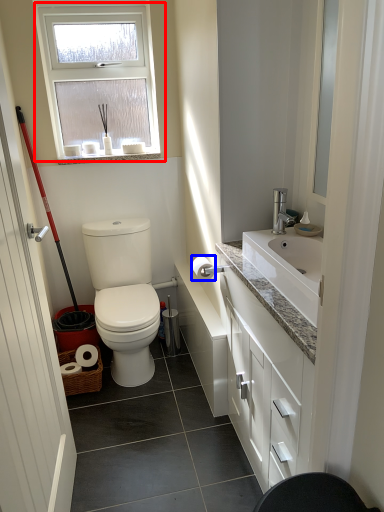
Question: Which object appears farthest to the camera in this image, window (highlighted by a red box) or toilet paper (highlighted by a blue box)?

Choices:
 (A) window
 (B) toilet paper

Answer: (A)